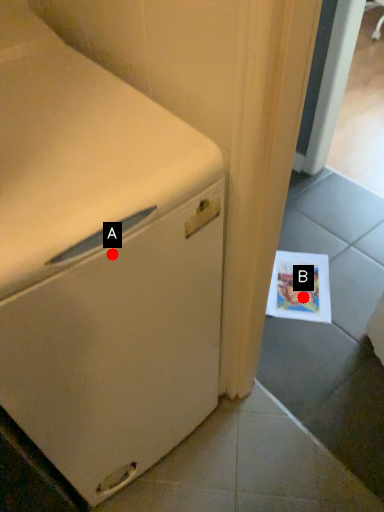
Question: Two points are circled on the image, labeled by A and B beside each circle. Which point appears farthest from the camera in this image?

Choices:
 (A) A is further
 (B) B is further

Answer: (B)